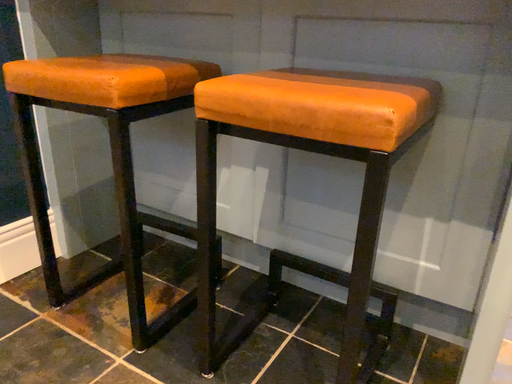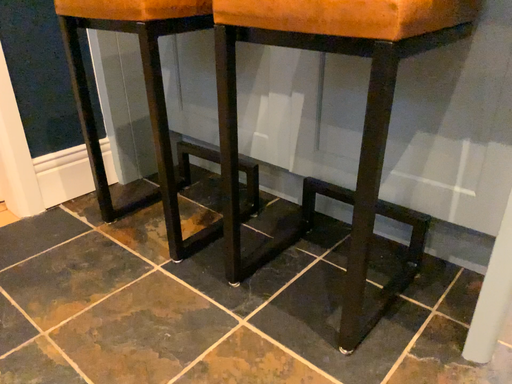
Question: Which way did the camera rotate in the video?

Choices:
 (A) rotated left
 (B) rotated right

Answer: (A)